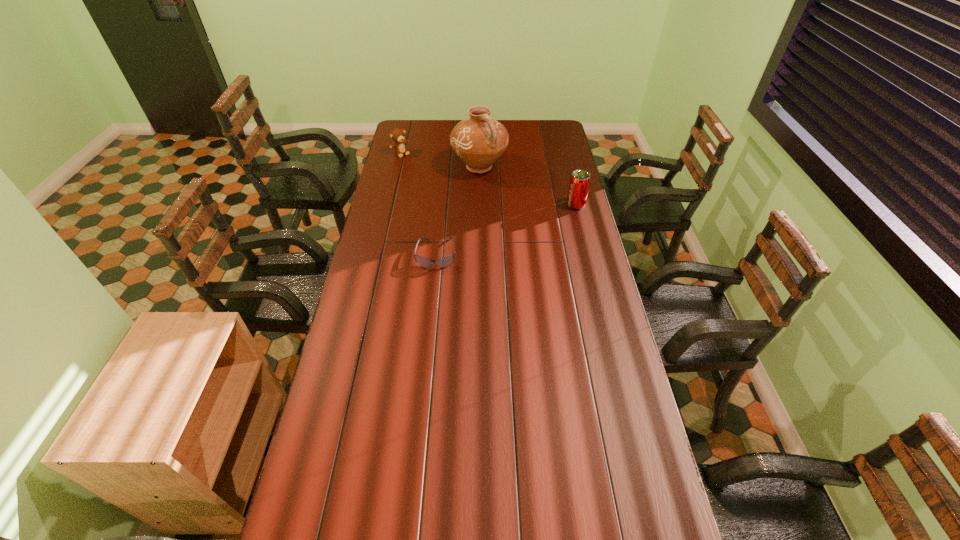
What are the coordinates of `the shortest object` in the screenshot? It's located at (443, 262).

Locate an element on the screen. The image size is (960, 540). the nearest object is located at coordinates (443, 262).

This screenshot has height=540, width=960. I want to click on the rightmost object, so click(x=580, y=180).

I want to click on the second tallest object, so click(x=580, y=180).

The image size is (960, 540). I want to click on the leftmost object, so click(x=397, y=135).

Identify the location of the third tallest object. This screenshot has height=540, width=960. (397, 135).

Find the location of `the tallest object`. the tallest object is located at coordinates (479, 140).

This screenshot has width=960, height=540. Find the location of `free point located on the lenses of the shortest object`. free point located on the lenses of the shortest object is located at coordinates (425, 356).

Identify the location of vacant space located 0.260m on the front of the third farthest object. (588, 252).

The width and height of the screenshot is (960, 540). I want to click on vacant position located 0.360m on the face of the third tallest object, so click(444, 191).